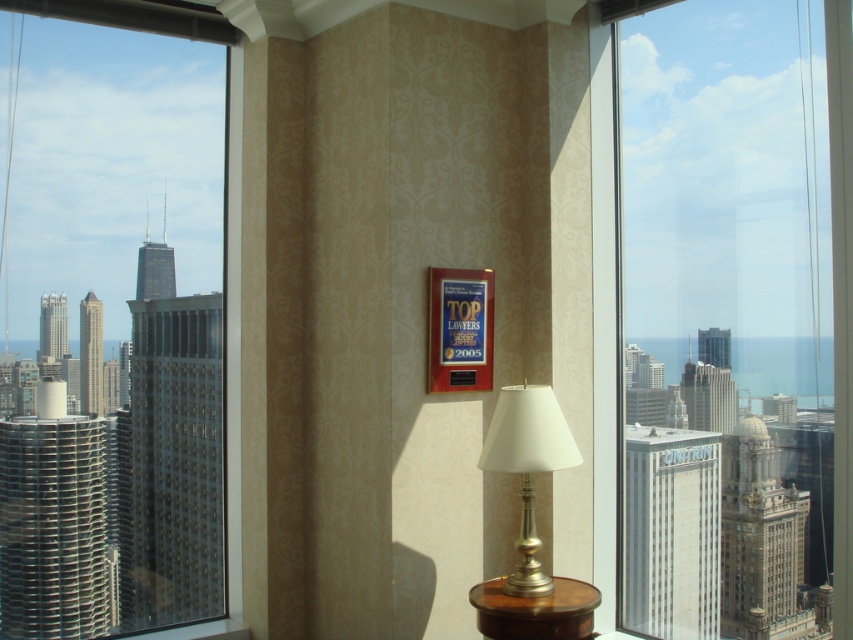
You are standing in the room and want to reach the silver metallic lamp at center from where you are. Is the transparent glass window at left blocking your path? Please explain.

The transparent glass window at left is further to the viewer than the silver metallic lamp at center, so the window is closer to you than the lamp. This means the window is not blocking your path to the lamp since it is in front of you, and the lamp is behind it.